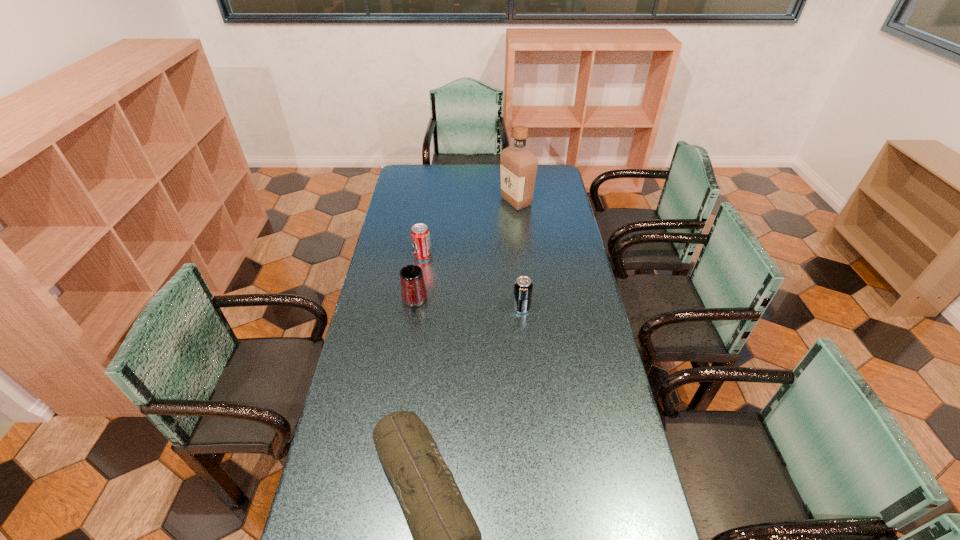
The image size is (960, 540). Find the location of `liquor`. liquor is located at coordinates click(x=518, y=165).

At what (x,y) coordinates should I click in order to perform the action: click on the farthest object. Please return your answer as a coordinate pair (x, y). This screenshot has width=960, height=540. Looking at the image, I should click on (518, 165).

At what (x,y) coordinates should I click in order to perform the action: click on the fourth nearest object. Please return your answer as a coordinate pair (x, y). The width and height of the screenshot is (960, 540). Looking at the image, I should click on (420, 235).

Locate an element on the screen. This screenshot has width=960, height=540. the left soda can is located at coordinates (420, 235).

Locate an element on the screen. mug is located at coordinates (413, 290).

This screenshot has height=540, width=960. Identify the location of the right soda can. (523, 287).

Locate an element on the screen. free spot located on the front-facing side of the farthest object is located at coordinates (471, 201).

Find the location of a particular element. This screenshot has height=540, width=960. free space located on the front-facing side of the farthest object is located at coordinates (464, 201).

Locate an element on the screen. vacant space located on the front-facing side of the farthest object is located at coordinates (430, 201).

Find the location of a particular element. The image size is (960, 540). vacant region located 0.270m on the front of the left soda can is located at coordinates (415, 308).